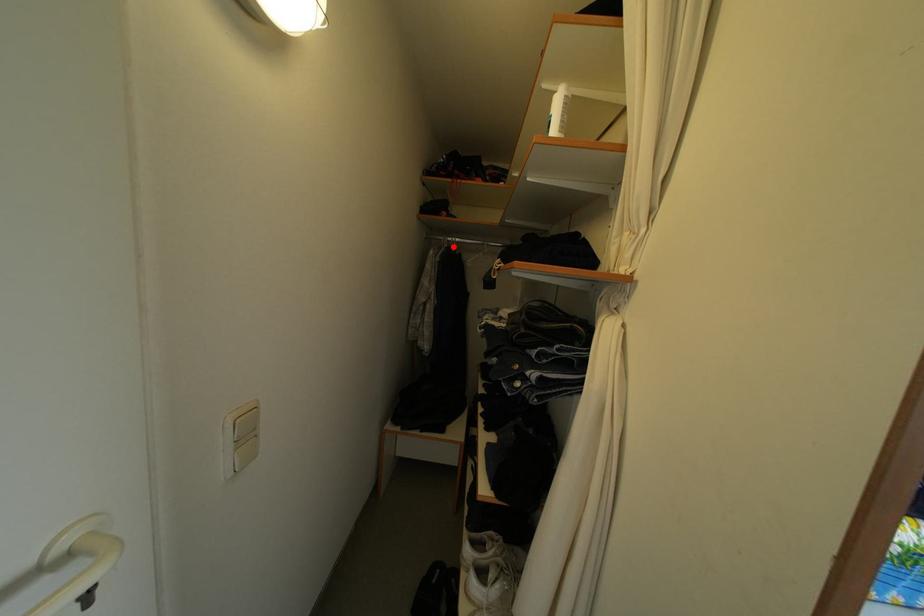
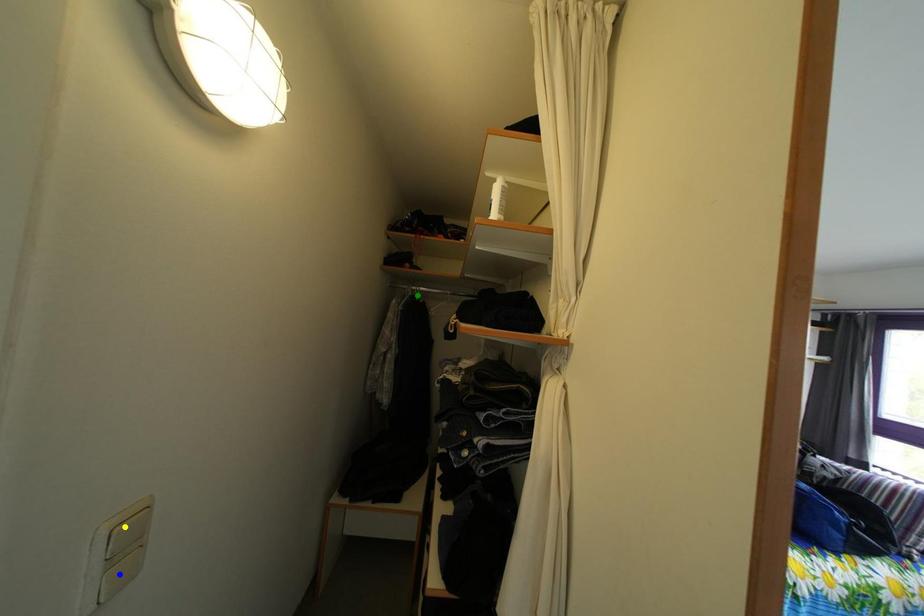
Question: I am providing you with two images of the same scene from different viewpoints. A red point is marked on the first image. You are given multiple points on the second image. Which point in image 2 is actually the same real-world point as the red point in image 1?

Choices:
 (A) blue point
 (B) green point
 (C) yellow point

Answer: (B)